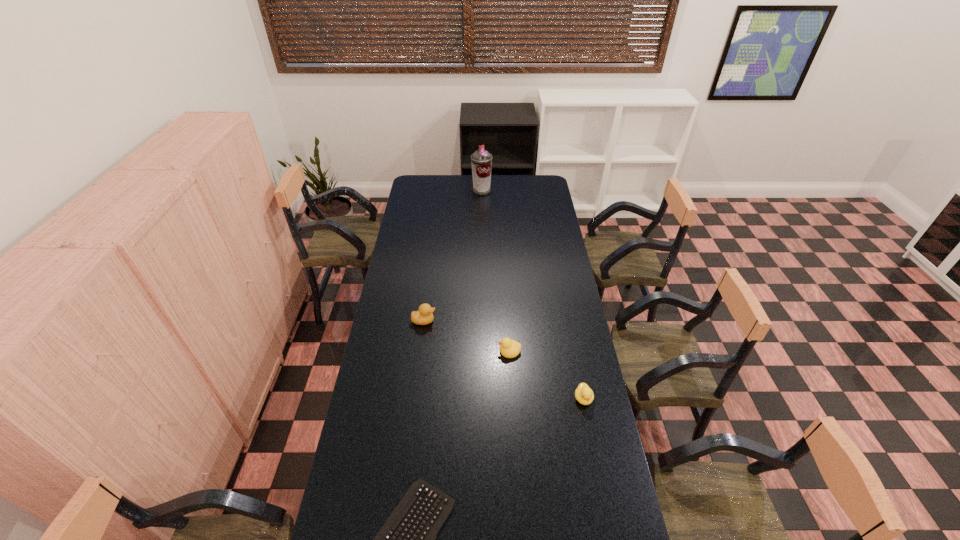
Point out which object is positioned as the nearest to the second duckling from right to left. Please provide its 2D coordinates. Your answer should be formatted as a tuple, i.e. [(x, y)], where the tuple contains the x and y coordinates of a point satisfying the conditions above.

[(584, 395)]

The height and width of the screenshot is (540, 960). Find the location of `duckling that is the closest to the rightmost duckling`. duckling that is the closest to the rightmost duckling is located at coordinates (509, 348).

Locate an element on the screen. The height and width of the screenshot is (540, 960). duckling that is the closest to the fourth object from left to right is located at coordinates (584, 395).